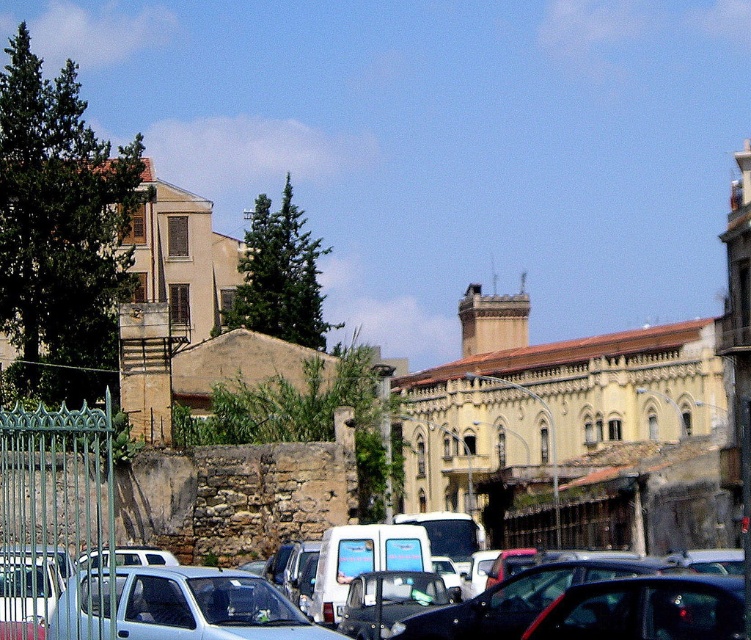
You are standing at the point closer to the camera between the two points, point (x=0, y=529) and point (x=89, y=573). Which point are you at?

You are at point (x=0, y=529) because it is further to the camera than point (x=89, y=573).

You are a delivery person trying to park your metallic silver car at center in the parking lot. There is a green wrought iron fence at left nearby. Based on the scene, can you park your car without hitting the fence?

The metallic silver car at center is positioned under the green wrought iron fence at left, meaning the fence is above the car. Since the fence is overhead, the car can park safely without hitting it.

You are driving a metallic silver car at center and want to park it near the green wrought iron fence at left. Given that your car is 4.5 meters long, will there be enough space between them to park without hitting the fence?

The metallic silver car at center and green wrought iron fence at left are 9.11 meters apart. Since the car is 4.5 meters long, there is sufficient space as 9.11 meters minus 4.5 meters leaves 4.61 meters of clearance, which is more than enough to park without hitting the fence.